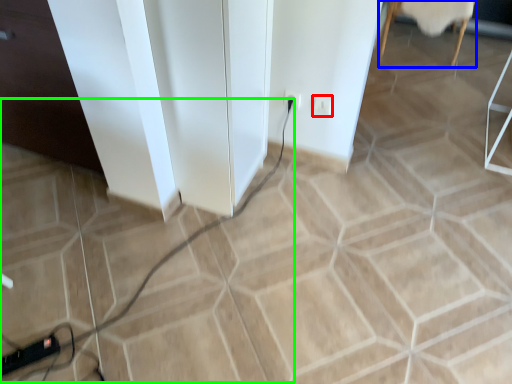
Question: Which object is the closest to the socket (highlighted by a red box)? Choose among these: furniture (highlighted by a blue box) or cable (highlighted by a green box).

Choices:
 (A) furniture
 (B) cable

Answer: (B)